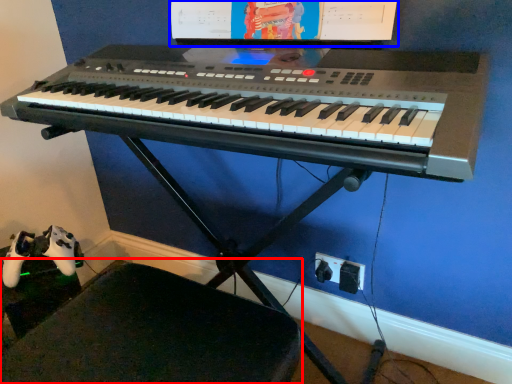
Question: Which of the following is the farthest to the observer, swivel chair (highlighted by a red box) or computer monitor (highlighted by a blue box)?

Choices:
 (A) swivel chair
 (B) computer monitor

Answer: (B)